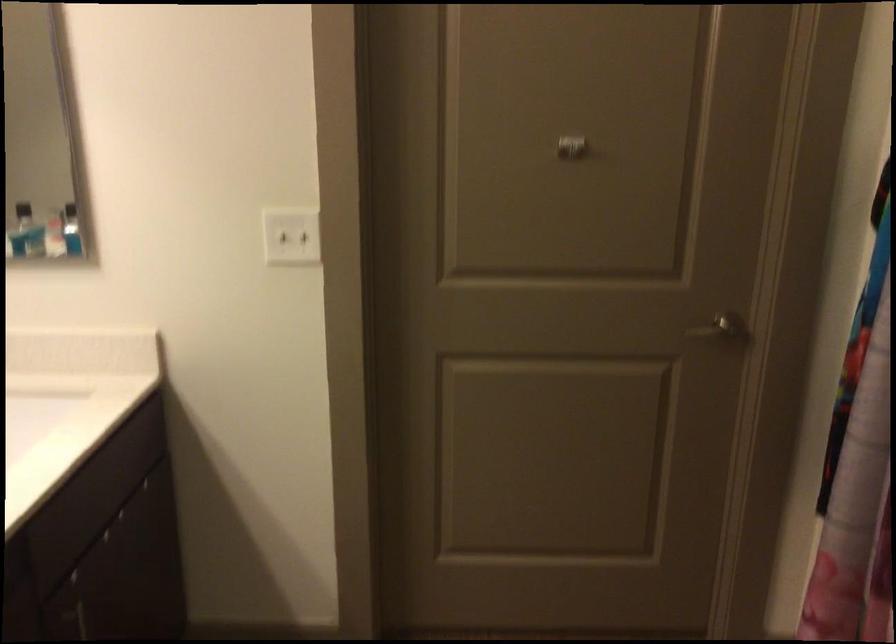
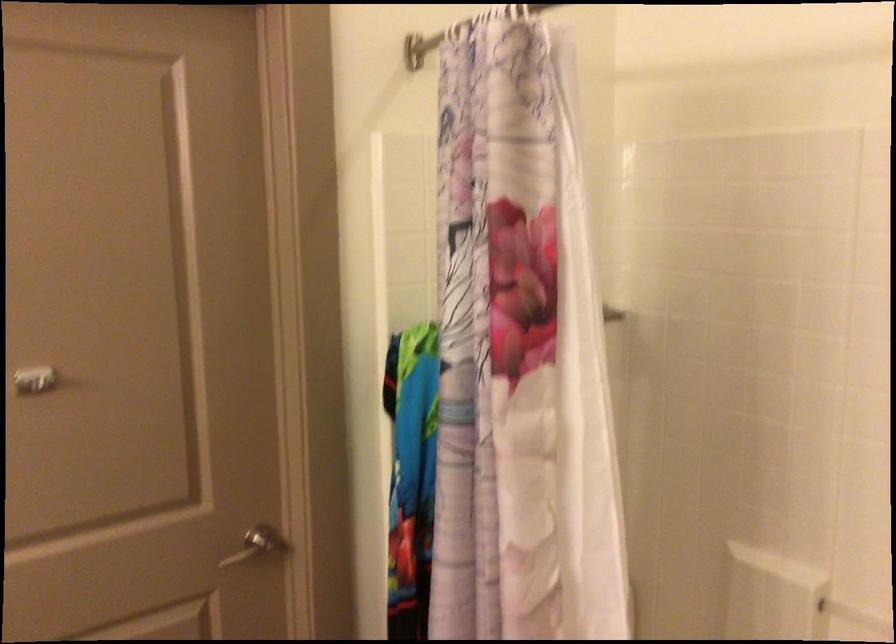
Where in the second image is the point corresponding to [725,328] from the first image?

(257, 545)